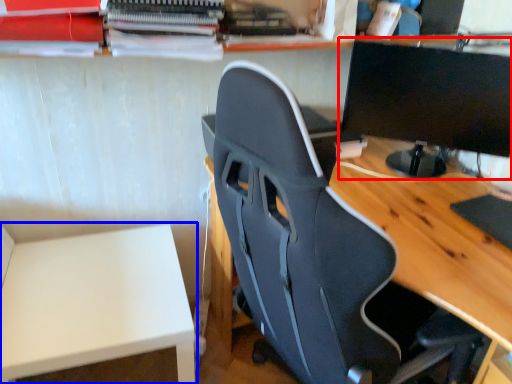
Question: Among these objects, which one is farthest to the camera, computer monitor (highlighted by a red box) or table (highlighted by a blue box)?

Choices:
 (A) computer monitor
 (B) table

Answer: (A)